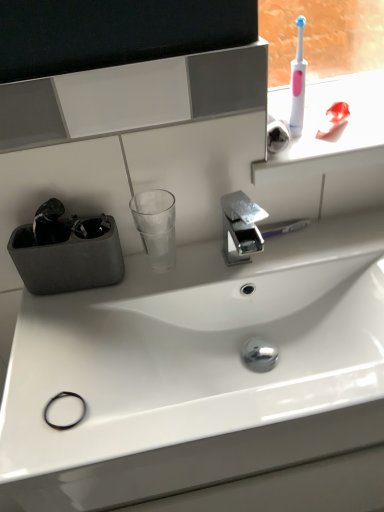
At what (x,y) coordinates should I click in order to perform the action: click on vacant space that's between polished chrome tap at center and transparent glass at center. Please return your answer as a coordinate pair (x, y). Looking at the image, I should click on (196, 269).